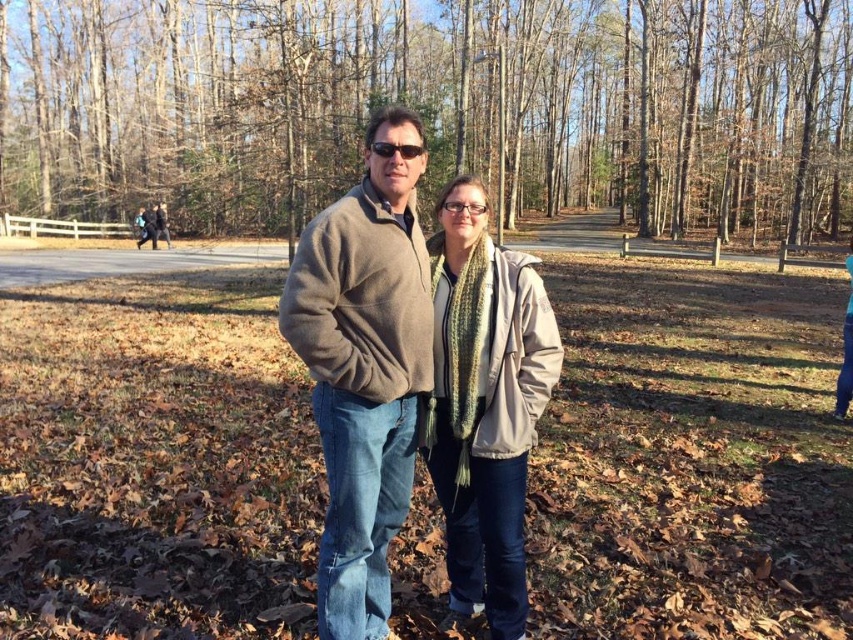
Question: Is brown textured tree at center above knitted scarf at center?

Choices:
 (A) yes
 (B) no

Answer: (A)

Question: Is brown textured tree at center to the right of dark blue jeans at left from the viewer's perspective?

Choices:
 (A) yes
 (B) no

Answer: (A)

Question: Estimate the real-world distances between objects in this image. Which object is farther from the knitted scarf at center?

Choices:
 (A) sunglasses at center
 (B) brown fleece jacket at center
 (C) brown textured tree at center
 (D) brown woolen sweater at center

Answer: (C)

Question: Which is nearer to the knitted scarf at center?

Choices:
 (A) brown fleece jacket at center
 (B) sunglasses at center

Answer: (A)

Question: Is brown textured tree at center smaller than sunglasses at center?

Choices:
 (A) no
 (B) yes

Answer: (A)

Question: Which point appears closest to the camera in this image?

Choices:
 (A) (154, 209)
 (B) (604, 605)
 (C) (299, 252)
 (D) (193, 234)

Answer: (C)